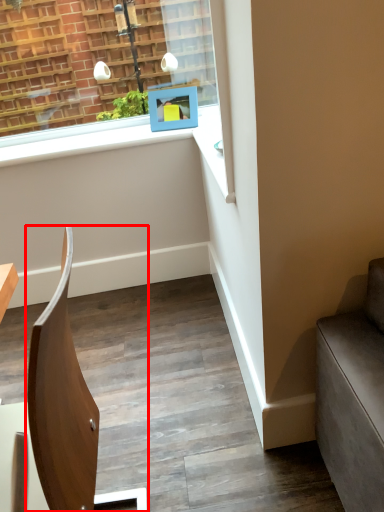
Question: In this image, where is chair (annotated by the red box) located relative to picture frame?

Choices:
 (A) right
 (B) left

Answer: (B)